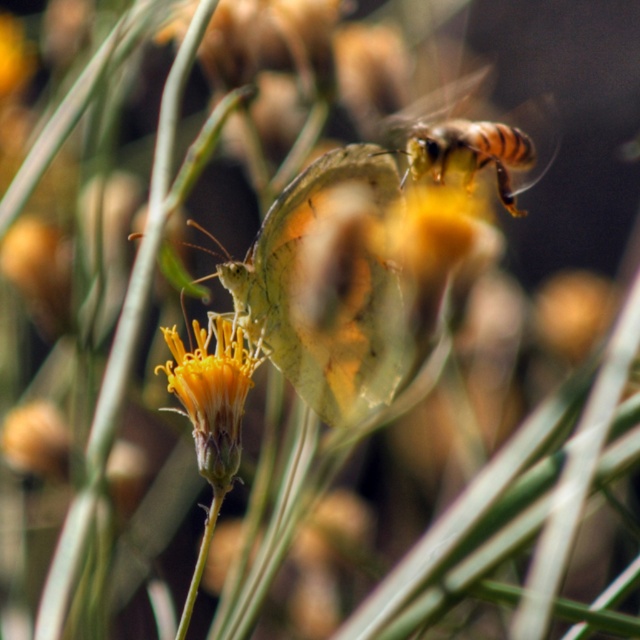
Question: Which is farther from the translucent yellow butterfly at center?

Choices:
 (A) brown striped bee at upper right
 (B) yellow matte flower at center

Answer: (A)

Question: Which of the following is the closest to the observer?

Choices:
 (A) 182,365
 (B) 250,291

Answer: (A)

Question: Can you confirm if translucent yellow butterfly at center is positioned to the left of yellow matte flower at center?

Choices:
 (A) no
 (B) yes

Answer: (A)

Question: Does translucent yellow butterfly at center appear under brown striped bee at upper right?

Choices:
 (A) yes
 (B) no

Answer: (A)

Question: Is translucent yellow butterfly at center to the right of brown striped bee at upper right from the viewer's perspective?

Choices:
 (A) no
 (B) yes

Answer: (A)

Question: Which point appears farthest from the camera in this image?

Choices:
 (A) (170, 387)
 (B) (404, 308)
 (C) (512, 138)

Answer: (C)